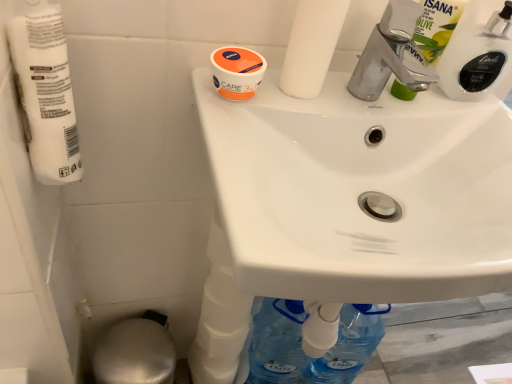
Question: From the image's perspective, is orange matte jar at upper center under white glossy sink at upper center?

Choices:
 (A) yes
 (B) no

Answer: (B)

Question: Are orange matte jar at upper center and white glossy sink at upper center making contact?

Choices:
 (A) no
 (B) yes

Answer: (A)

Question: Is orange matte jar at upper center bigger than white glossy sink at upper center?

Choices:
 (A) no
 (B) yes

Answer: (A)

Question: From a real-world perspective, is orange matte jar at upper center physically above white glossy sink at upper center?

Choices:
 (A) no
 (B) yes

Answer: (B)

Question: Considering the relative sizes of orange matte jar at upper center and white glossy sink at upper center in the image provided, is orange matte jar at upper center smaller than white glossy sink at upper center?

Choices:
 (A) yes
 (B) no

Answer: (A)

Question: Is orange matte jar at upper center closer to the viewer compared to white glossy sink at upper center?

Choices:
 (A) yes
 (B) no

Answer: (B)

Question: Is the depth of white matte toilet paper at upper center, which ranks as the second toilet paper in left-to-right order, greater than that of silver metallic bidet at lower left?

Choices:
 (A) yes
 (B) no

Answer: (B)

Question: Is white matte toilet paper at upper center, the 1th toilet paper positioned from the right, facing towards silver metallic bidet at lower left?

Choices:
 (A) no
 (B) yes

Answer: (A)

Question: Considering the relative sizes of white matte toilet paper at upper center, which ranks as the second toilet paper in left-to-right order, and silver metallic bidet at lower left in the image provided, is white matte toilet paper at upper center, which ranks as the second toilet paper in left-to-right order, wider than silver metallic bidet at lower left?

Choices:
 (A) yes
 (B) no

Answer: (B)

Question: Is silver metallic bidet at lower left located within white matte toilet paper at upper center, which ranks as the second toilet paper in left-to-right order?

Choices:
 (A) no
 (B) yes

Answer: (A)

Question: Is white matte toilet paper at upper center, which ranks as the second toilet paper in left-to-right order, closer to camera compared to silver metallic bidet at lower left?

Choices:
 (A) no
 (B) yes

Answer: (B)

Question: Is white matte toilet paper at upper center, the 1th toilet paper positioned from the right, next to silver metallic bidet at lower left and touching it?

Choices:
 (A) no
 (B) yes

Answer: (A)

Question: Is white glossy bottle at upper right, marked as the 2th cleaning product in a left-to-right arrangement, not within white matte toilet paper at upper center, which ranks as the second toilet paper in left-to-right order?

Choices:
 (A) no
 (B) yes

Answer: (B)